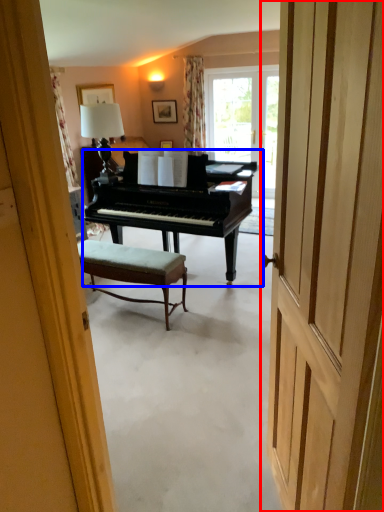
Question: Which object is further to the camera taking this photo, door (highlighted by a red box) or piano (highlighted by a blue box)?

Choices:
 (A) door
 (B) piano

Answer: (B)